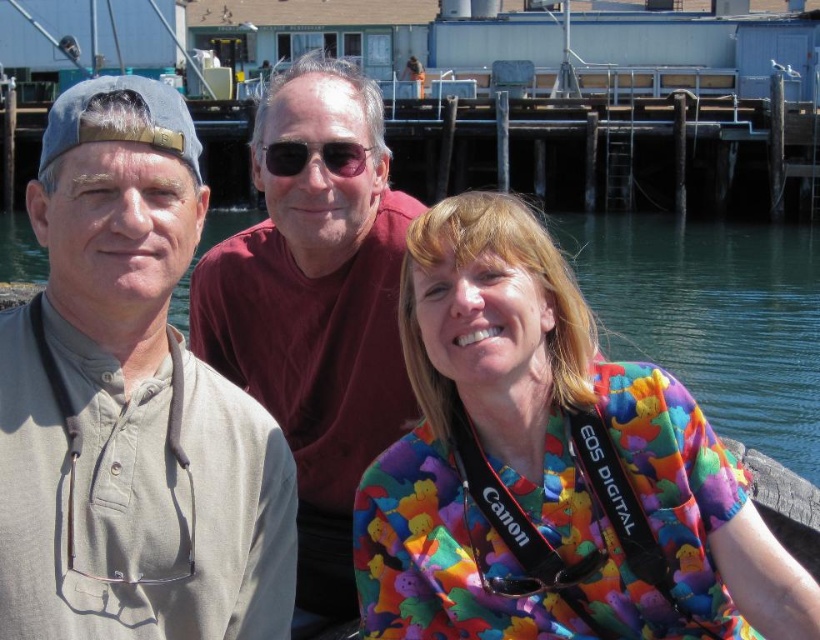
Can you confirm if maroon cotton shirt at center is positioned to the right of clear water at center?

Incorrect, maroon cotton shirt at center is not on the right side of clear water at center.

Which is more to the right, maroon cotton shirt at center or clear water at center?

Positioned to the right is clear water at center.

Does point (267, 212) come closer to viewer compared to point (771, 289)?

That is True.

Locate an element on the screen. Image resolution: width=820 pixels, height=640 pixels. maroon cotton shirt at center is located at coordinates (317, 310).

Who is positioned more to the right, khaki cotton shirt at left or maroon cotton shirt at center?

khaki cotton shirt at left

Consider the image. Is khaki cotton shirt at left closer to the viewer compared to maroon cotton shirt at center?

Yes, khaki cotton shirt at left is in front of maroon cotton shirt at center.

Is point (28, 333) in front of point (376, 172)?

Yes, it is in front of point (376, 172).

The height and width of the screenshot is (640, 820). In order to click on khaki cotton shirt at left in this screenshot , I will do `click(131, 410)`.

Does multicolored fabric shirt at center appear on the right side of clear water at center?

Yes, multicolored fabric shirt at center is to the right of clear water at center.

Between point (454, 536) and point (631, 352), which one is positioned in front?

Point (454, 536)

Where is `multicolored fabric shirt at center`? multicolored fabric shirt at center is located at coordinates (550, 467).